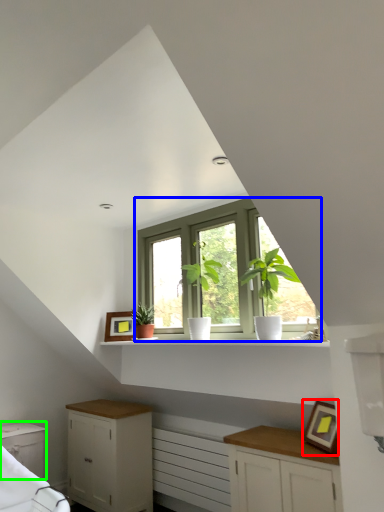
Question: Considering the real-world distances, which object is closest to picture frame (highlighted by a red box)? window (highlighted by a blue box) or cabinetry (highlighted by a green box).

Choices:
 (A) window
 (B) cabinetry

Answer: (A)